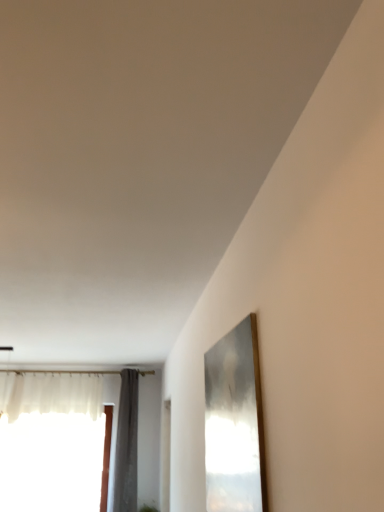
Question: Is gray fabric curtain at left not within translucent fabric window at left?

Choices:
 (A) yes
 (B) no

Answer: (A)

Question: Could you tell me if gray fabric curtain at left is turned towards translucent fabric window at left?

Choices:
 (A) yes
 (B) no

Answer: (B)

Question: Does gray fabric curtain at left have a lesser height compared to translucent fabric window at left?

Choices:
 (A) yes
 (B) no

Answer: (B)

Question: From a real-world perspective, is gray fabric curtain at left located higher than translucent fabric window at left?

Choices:
 (A) yes
 (B) no

Answer: (A)

Question: Is gray fabric curtain at left facing away from translucent fabric window at left?

Choices:
 (A) yes
 (B) no

Answer: (B)

Question: Is translucent fabric window at left completely or partially inside gray fabric curtain at left?

Choices:
 (A) no
 (B) yes

Answer: (A)

Question: Is translucent fabric window at left to the left of gray fabric curtain at left from the viewer's perspective?

Choices:
 (A) yes
 (B) no

Answer: (A)

Question: From the image's perspective, is translucent fabric window at left located above gray fabric curtain at left?

Choices:
 (A) yes
 (B) no

Answer: (B)

Question: Considering the relative sizes of translucent fabric window at left and gray fabric curtain at left in the image provided, is translucent fabric window at left bigger than gray fabric curtain at left?

Choices:
 (A) yes
 (B) no

Answer: (A)

Question: From a real-world perspective, is translucent fabric window at left on top of gray fabric curtain at left?

Choices:
 (A) no
 (B) yes

Answer: (A)

Question: Is there a large distance between translucent fabric window at left and gray fabric curtain at left?

Choices:
 (A) yes
 (B) no

Answer: (B)

Question: Is translucent fabric window at left looking in the opposite direction of gray fabric curtain at left?

Choices:
 (A) yes
 (B) no

Answer: (B)

Question: Considering the positions of gray fabric curtain at left and translucent fabric window at left in the image, is gray fabric curtain at left wider or thinner than translucent fabric window at left?

Choices:
 (A) wide
 (B) thin

Answer: (A)